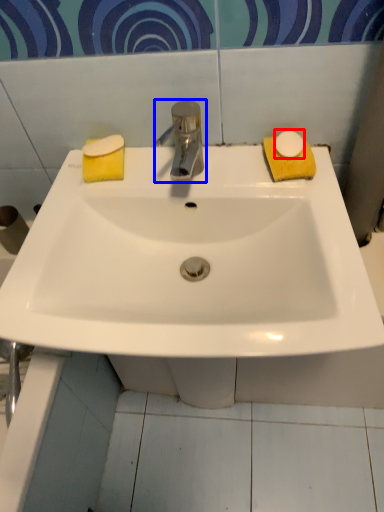
Question: Which point is further to the camera, soap (highlighted by a red box) or tap (highlighted by a blue box)?

Choices:
 (A) soap
 (B) tap

Answer: (A)